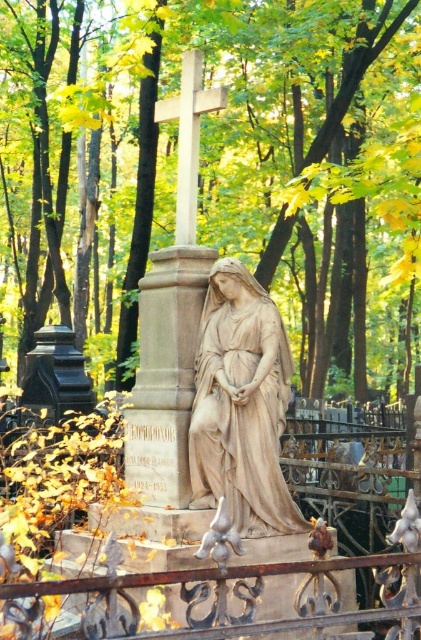
You are visiting the cemetery and want to take a photo of the white stone cross at center without the brown wrought iron fence at lower center appearing in the frame. How should you adjust your camera angle?

To avoid capturing the brown wrought iron fence at lower center in your photo, you can angle your camera upward so that the white stone cross at center comes into view while the fence is blocked by the cross itself, as the fence is positioned under the cross.

You are standing at the entrance of the cemetery and want to take a photo of the beige stone statue at center. If your camera has a maximum zoom range of 35 meters, will you be able to capture the entire statue in the photo without moving closer?

The beige stone statue at center is 37.12 meters away from the viewer. Since the camera can only zoom up to 35 meters, you will not be able to capture the entire statue in the photo without moving closer.

You are standing in the cemetery and want to take a photo of both the green leafy tree at center and the white stone cross at center. Which object will appear bigger in your camera viewfinder?

The green leafy tree at center will appear bigger in the camera viewfinder because it is larger in size than the white stone cross at center.